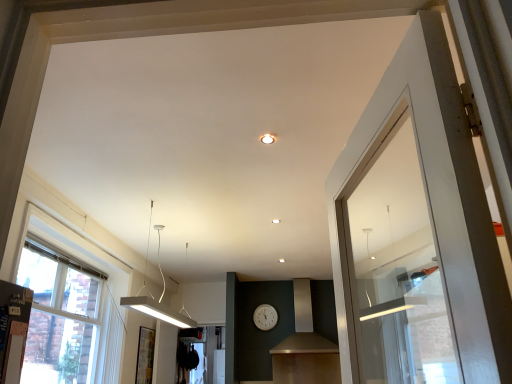
Question: Considering the relative positions of matte white ceiling light at center and matte black vent at center in the image provided, is matte white ceiling light at center behind matte black vent at center?

Choices:
 (A) yes
 (B) no

Answer: (B)

Question: Is matte white ceiling light at center touching matte black vent at center?

Choices:
 (A) no
 (B) yes

Answer: (A)

Question: Is matte white ceiling light at center wider than matte black vent at center?

Choices:
 (A) yes
 (B) no

Answer: (B)

Question: From the image's perspective, would you say matte white ceiling light at center is shown under matte black vent at center?

Choices:
 (A) no
 (B) yes

Answer: (A)

Question: Would you say matte black vent at center is part of matte white ceiling light at center's contents?

Choices:
 (A) yes
 (B) no

Answer: (B)

Question: From the image's perspective, would you say matte white ceiling light at center is positioned over matte black vent at center?

Choices:
 (A) yes
 (B) no

Answer: (A)

Question: From a real-world perspective, is matte black vent at center below white wood window at left?

Choices:
 (A) no
 (B) yes

Answer: (A)

Question: Are matte black vent at center and white wood window at left located far from each other?

Choices:
 (A) yes
 (B) no

Answer: (A)

Question: Is matte black vent at center not within white wood window at left?

Choices:
 (A) no
 (B) yes

Answer: (B)

Question: Is matte black vent at center thinner than white wood window at left?

Choices:
 (A) yes
 (B) no

Answer: (B)

Question: Is matte black vent at center positioned in front of white wood window at left?

Choices:
 (A) yes
 (B) no

Answer: (B)

Question: Is matte black vent at center aimed at white wood window at left?

Choices:
 (A) yes
 (B) no

Answer: (B)

Question: From the image's perspective, does white wood window at left appear higher than matte white ceiling light at center?

Choices:
 (A) no
 (B) yes

Answer: (A)